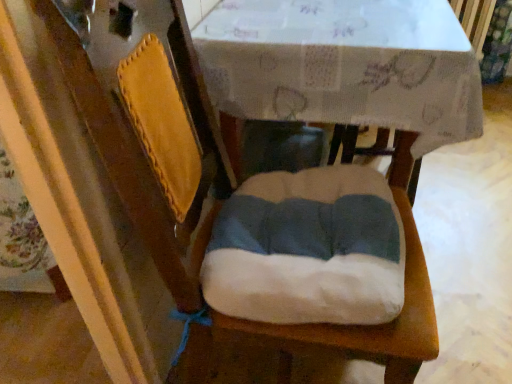
Question: Is the position of white paper at center more distant than that of white fabric cushion at center?

Choices:
 (A) yes
 (B) no

Answer: (B)

Question: Does white paper at center turn towards white fabric cushion at center?

Choices:
 (A) yes
 (B) no

Answer: (B)

Question: Considering the relative sizes of white paper at center and white fabric cushion at center in the image provided, is white paper at center wider than white fabric cushion at center?

Choices:
 (A) no
 (B) yes

Answer: (A)

Question: Is white paper at center far from white fabric cushion at center?

Choices:
 (A) no
 (B) yes

Answer: (A)

Question: Does white paper at center have a lesser width compared to white fabric cushion at center?

Choices:
 (A) yes
 (B) no

Answer: (A)

Question: Is white paper at center beside white fabric cushion at center?

Choices:
 (A) yes
 (B) no

Answer: (B)

Question: Is white fabric cushion at center wider than white paper at center?

Choices:
 (A) no
 (B) yes

Answer: (B)

Question: From a real-world perspective, is white fabric cushion at center positioned over white paper at center based on gravity?

Choices:
 (A) no
 (B) yes

Answer: (A)

Question: Would you say white paper at center is part of white fabric cushion at center's contents?

Choices:
 (A) no
 (B) yes

Answer: (A)

Question: Does white fabric cushion at center have a lesser width compared to white paper at center?

Choices:
 (A) no
 (B) yes

Answer: (A)

Question: From the image's perspective, does white fabric cushion at center appear higher than white paper at center?

Choices:
 (A) yes
 (B) no

Answer: (B)

Question: Considering the relative positions of white fabric cushion at center and white paper at center in the image provided, is white fabric cushion at center to the right of white paper at center from the viewer's perspective?

Choices:
 (A) no
 (B) yes

Answer: (B)

Question: From a real-world perspective, is white paper at center positioned above or below white fabric cushion at center?

Choices:
 (A) below
 (B) above

Answer: (B)